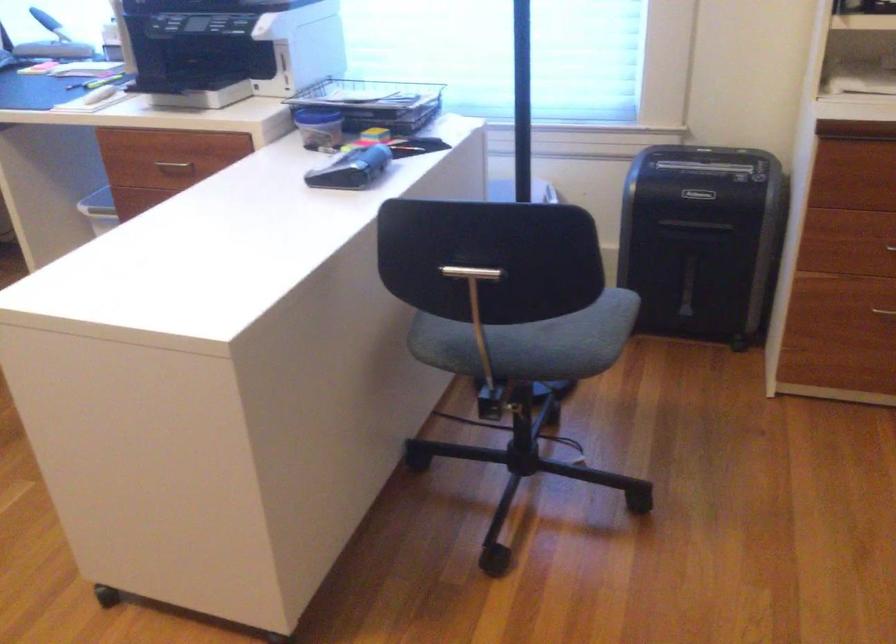
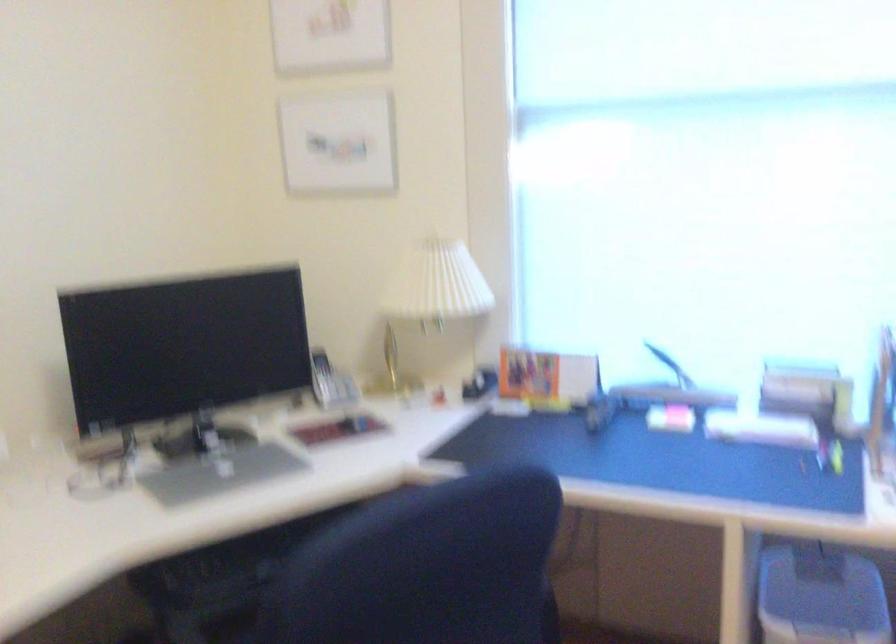
Question: The images are taken continuously from a first-person perspective. In which direction are you moving?

Choices:
 (A) Left
 (B) Right
 (C) Forward
 (D) Backward

Answer: (A)